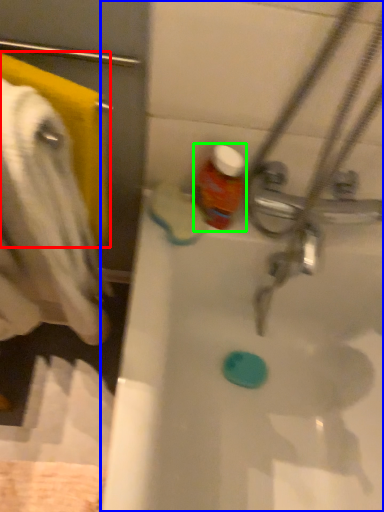
Question: Which object is positioned closest to towel/napkin (highlighted by a red box)? Select from bathtub (highlighted by a blue box) and bottle (highlighted by a green box).

Choices:
 (A) bathtub
 (B) bottle

Answer: (B)